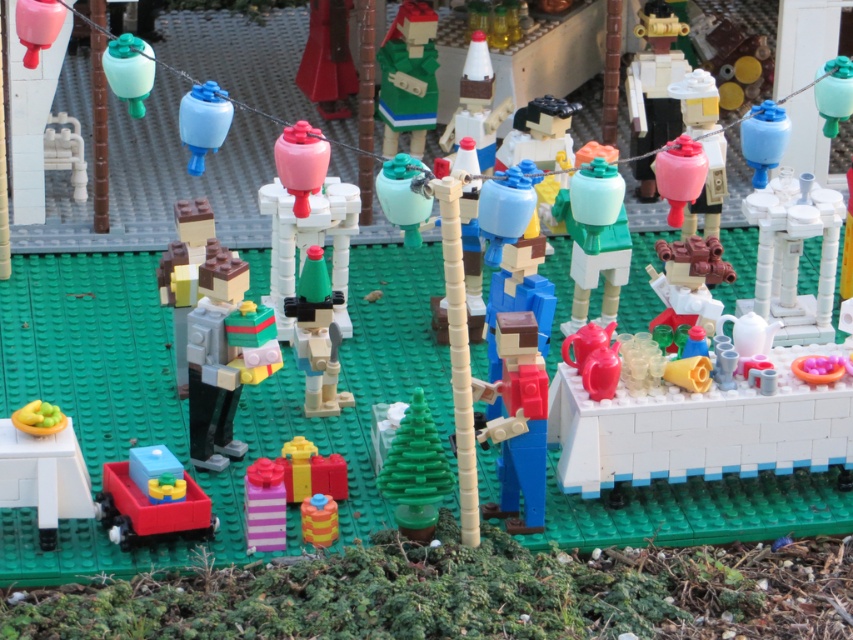
You are a photographer standing in front of the Lego diorama scene. You want to take a photo focusing on the matte gold robot at upper right. Based on its position, where should you aim your camera to capture it best?

The matte gold robot at upper right is located at coordinates approximately 0.122 on the x axis and 0.769 on the y axis, so you should aim your camera towards the upper right corner of the scene, specifically targeting the point at x 0.122 and y 0.769 to capture it best.

You are a Lego figure standing at the base of the tree. You want to hang a decoration on the blue glossy lantern at upper right. However, there is a matte gold robot at upper right in the way. Which object is closer to you so you can move it first?

The matte gold robot at upper right is positioned on the left side of blue glossy lantern at upper right, so the matte gold robot at upper right is closer to you and should be moved first.

You are standing in front of the Lego diorama and want to know how far the point at coordinates point [4,442] is from your eyes. Can you determine the distance?

The distance of point [4,442] from camera is 42.12 feet.